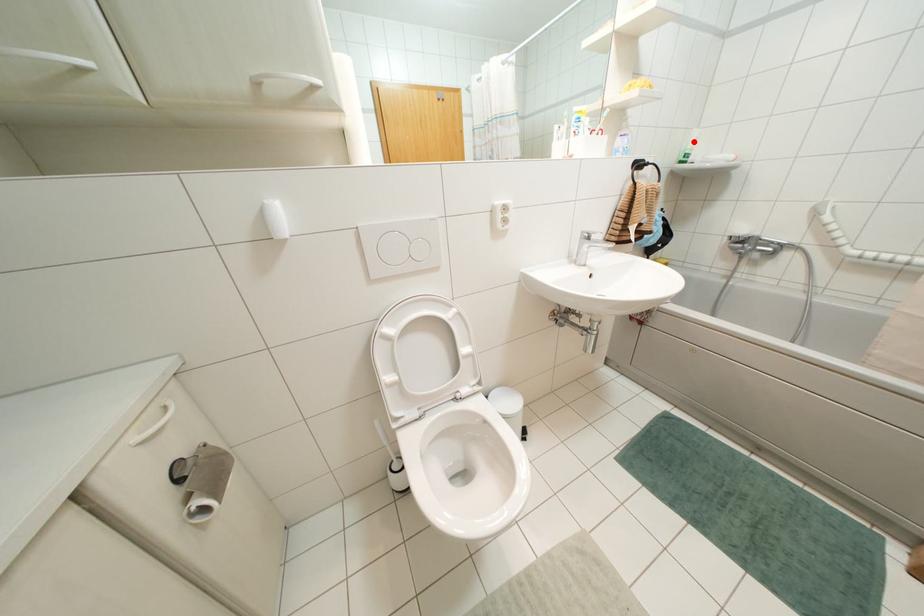
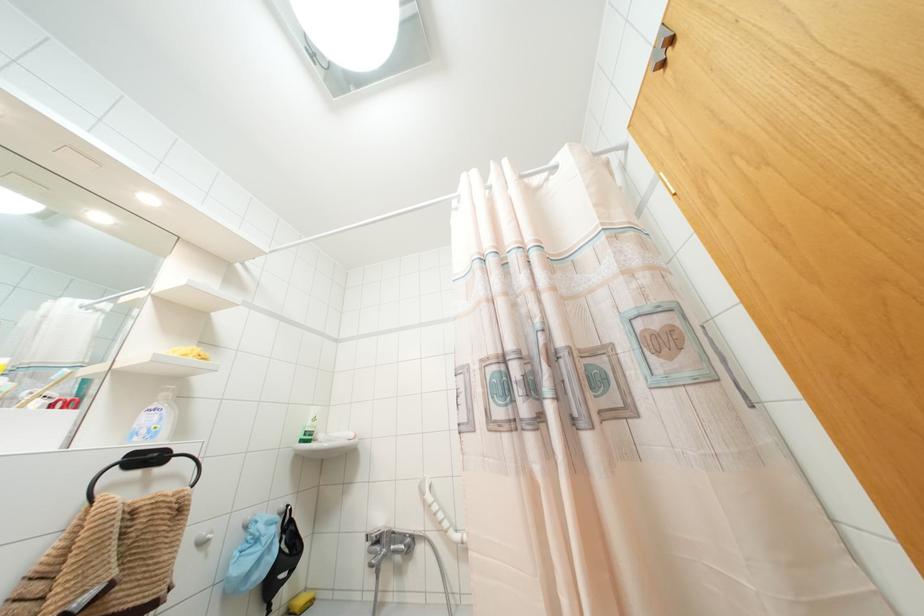
The point at the highlighted location is marked in the first image. Where is the corresponding point in the second image?

(312, 419)